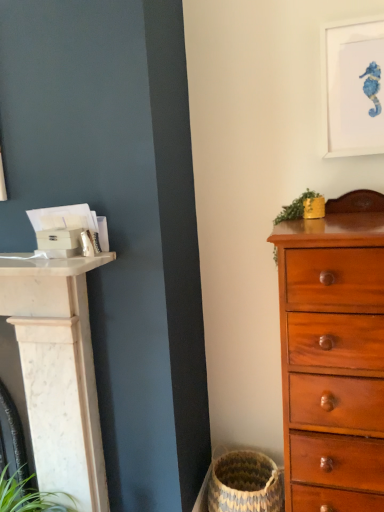
Where is `natural woven basket at lower center`? The image size is (384, 512). natural woven basket at lower center is located at coordinates (245, 483).

In order to face green leafy plant at upper right, should I rotate leftwards or rightwards?

You should look right and rotate roughly 14.035 degrees.

In order to click on mahogany wooden chest of drawers at right in this screenshot , I will do [333, 355].

Which of these two, mahogany wooden chest of drawers at right or natural woven basket at lower center, stands taller?

mahogany wooden chest of drawers at right is taller.

From the image's perspective, relative to natural woven basket at lower center, is mahogany wooden chest of drawers at right above or below?

From the image's perspective, mahogany wooden chest of drawers at right appears above natural woven basket at lower center.

Which is more to the left, mahogany wooden chest of drawers at right or natural woven basket at lower center?

From the viewer's perspective, natural woven basket at lower center appears more on the left side.

From a real-world perspective, is natural woven basket at lower center physically above white matte picture frame at upper right?

Actually, natural woven basket at lower center is physically below white matte picture frame at upper right in the real world.

Is natural woven basket at lower center to the left or to the right of white matte picture frame at upper right in the image?

In the image, natural woven basket at lower center appears on the left side of white matte picture frame at upper right.

Is natural woven basket at lower center smaller than white matte picture frame at upper right?

No.

Which is less distant, [285,261] or [297,209]?

The point [285,261] is more forward.

Locate an element on the screen. This screenshot has width=384, height=512. the chest of drawers lying below the green leafy plant at upper right (from the image's perspective) is located at coordinates (333, 355).

Which object is closer to the camera taking this photo, mahogany wooden chest of drawers at right or green leafy plant at upper right?

mahogany wooden chest of drawers at right is closer to the camera.

Would you consider natural woven basket at lower center to be distant from mahogany wooden chest of drawers at right?

No.

In terms of height, does natural woven basket at lower center look taller or shorter compared to mahogany wooden chest of drawers at right?

Clearly, natural woven basket at lower center is shorter compared to mahogany wooden chest of drawers at right.

From the image's perspective, between natural woven basket at lower center and mahogany wooden chest of drawers at right, who is located below?

natural woven basket at lower center.

Can you confirm if natural woven basket at lower center is smaller than mahogany wooden chest of drawers at right?

Yes, natural woven basket at lower center is smaller than mahogany wooden chest of drawers at right.

Can you tell me how much mahogany wooden chest of drawers at right and white matte picture frame at upper right differ in facing direction?

mahogany wooden chest of drawers at right and white matte picture frame at upper right are facing 3.57 degrees away from each other.

Is mahogany wooden chest of drawers at right at the left side of white matte picture frame at upper right?

Yes.

Based on the photo, which is behind, mahogany wooden chest of drawers at right or white matte picture frame at upper right?

white matte picture frame at upper right is more distant.

Considering the sizes of mahogany wooden chest of drawers at right and white matte picture frame at upper right in the image, is mahogany wooden chest of drawers at right taller or shorter than white matte picture frame at upper right?

Considering their sizes, mahogany wooden chest of drawers at right has more height than white matte picture frame at upper right.

From the image's perspective, would you say white matte picture frame at upper right is positioned over mahogany wooden chest of drawers at right?

Yes.

Could you tell me if white matte picture frame at upper right is turned towards mahogany wooden chest of drawers at right?

No, white matte picture frame at upper right is not aimed at mahogany wooden chest of drawers at right.

Which is in front, point (323, 109) or point (301, 301)?

The point (301, 301) is closer.

Between white matte picture frame at upper right and natural woven basket at lower center, which one has smaller width?

With smaller width is white matte picture frame at upper right.

What's the angular difference between white matte picture frame at upper right and natural woven basket at lower center's facing directions?

There is a 8.95-degree angle between the facing directions of white matte picture frame at upper right and natural woven basket at lower center.

Is white matte picture frame at upper right with natural woven basket at lower center?

No, white matte picture frame at upper right is not next to natural woven basket at lower center.

From a real-world perspective, is white matte picture frame at upper right physically above natural woven basket at lower center?

Yes, from a real-world perspective, white matte picture frame at upper right is above natural woven basket at lower center.

There is a natural woven basket at lower center. Identify the location of the chest of drawers above it (from a real-world perspective). The image size is (384, 512). click(333, 355).

Find the location of a particular element. The height and width of the screenshot is (512, 384). picture frame that is on the right side of natural woven basket at lower center is located at coordinates (x=353, y=88).

Considering their positions, is green leafy plant at upper right positioned closer to mahogany wooden chest of drawers at right than white matte picture frame at upper right?

Among the two, green leafy plant at upper right is located nearer to mahogany wooden chest of drawers at right.

Estimate the real-world distances between objects in this image. Which object is further from white matte picture frame at upper right, green leafy plant at upper right or natural woven basket at lower center?

Among the two, natural woven basket at lower center is located further to white matte picture frame at upper right.

Based on their spatial positions, is white matte picture frame at upper right or mahogany wooden chest of drawers at right further from green leafy plant at upper right?

mahogany wooden chest of drawers at right is further to green leafy plant at upper right.

Considering their positions, is white matte picture frame at upper right positioned closer to mahogany wooden chest of drawers at right than natural woven basket at lower center?

The object closer to mahogany wooden chest of drawers at right is natural woven basket at lower center.

Estimate the real-world distances between objects in this image. Which object is further from natural woven basket at lower center, white matte picture frame at upper right or mahogany wooden chest of drawers at right?

Based on the image, white matte picture frame at upper right appears to be further to natural woven basket at lower center.

Which object lies further to the anchor point mahogany wooden chest of drawers at right, green leafy plant at upper right or natural woven basket at lower center?

natural woven basket at lower center.

In the scene shown: Based on their spatial positions, is white matte picture frame at upper right or green leafy plant at upper right further from mahogany wooden chest of drawers at right?

The object further to mahogany wooden chest of drawers at right is white matte picture frame at upper right.

From the image, which object appears to be nearer to green leafy plant at upper right, mahogany wooden chest of drawers at right or natural woven basket at lower center?

mahogany wooden chest of drawers at right lies closer to green leafy plant at upper right than the other object.

At what (x,y) coordinates should I click in order to perform the action: click on the chest of drawers that lies between green leafy plant at upper right and natural woven basket at lower center from top to bottom. Please return your answer as a coordinate pair (x, y). Looking at the image, I should click on coord(333,355).

You are a GUI agent. You are given a task and a screenshot of the screen. Output one action in this format:
    pyautogui.click(x=<x>, y=<y>)
    Task: Click on the plant that lies between white matte picture frame at upper right and mahogany wooden chest of drawers at right from top to bottom
    
    Given the screenshot: What is the action you would take?
    pyautogui.click(x=295, y=208)

Image resolution: width=384 pixels, height=512 pixels. What are the coordinates of `plant between white matte picture frame at upper right and natural woven basket at lower center from top to bottom` in the screenshot? It's located at (295, 208).

You are a GUI agent. You are given a task and a screenshot of the screen. Output one action in this format:
    pyautogui.click(x=<x>, y=<y>)
    Task: Click on the chest of drawers that lies between white matte picture frame at upper right and natural woven basket at lower center from top to bottom
    The height and width of the screenshot is (512, 384).
    Given the screenshot: What is the action you would take?
    pyautogui.click(x=333, y=355)